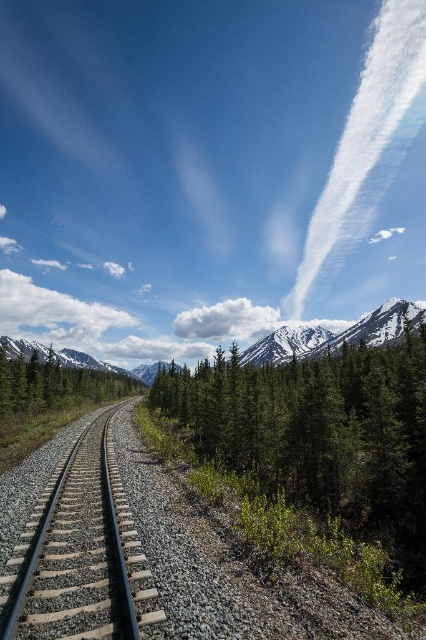
Who is positioned more to the left, green matte tree at center or smooth steel tracks at center?

Positioned to the left is smooth steel tracks at center.

Is green matte tree at center below smooth steel tracks at center?

Indeed, green matte tree at center is positioned under smooth steel tracks at center.

What do you see at coordinates (317, 428) in the screenshot?
I see `green matte tree at center` at bounding box center [317, 428].

Where is `green matte tree at center`? green matte tree at center is located at coordinates (317, 428).

From the picture: Between green matte tree at center and green matte tree at left, which one has less height?

green matte tree at center

Is green matte tree at center to the left of green matte tree at left from the viewer's perspective?

No, green matte tree at center is not to the left of green matte tree at left.

Who is more forward, (393, 404) or (62, 378)?

Point (393, 404) is in front.

Find the location of `green matte tree at center`. green matte tree at center is located at coordinates point(317,428).

From the picture: Measure the distance between smooth steel tracks at center and snowy granite mountain at upper center.

A distance of 308.05 meters exists between smooth steel tracks at center and snowy granite mountain at upper center.

Does smooth steel tracks at center appear on the right side of snowy granite mountain at upper center?

Incorrect, smooth steel tracks at center is not on the right side of snowy granite mountain at upper center.

I want to click on smooth steel tracks at center, so click(x=80, y=552).